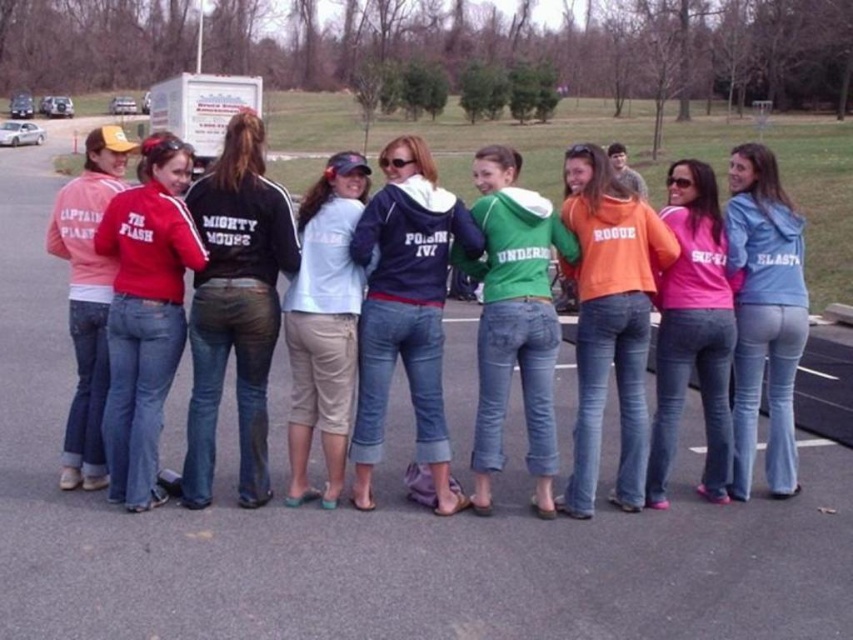
You are organizing a group photo and need to arrange the navy blue hoodie at center and the orange fleece jacket at center so that they are side by side without overlapping. Which one should be placed on the left to ensure there is enough space between them?

The navy blue hoodie at center should be placed on the left since it might be wider than the orange fleece jacket at center, allowing sufficient space between them when arranged side by side.